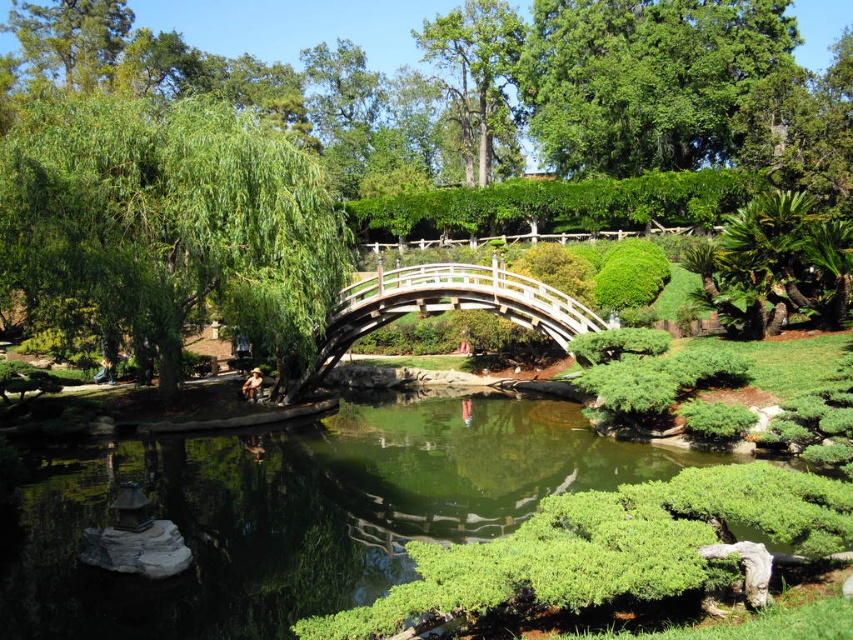
Question: Is green leafy tree at center smaller than wooden bridge at center?

Choices:
 (A) yes
 (B) no

Answer: (B)

Question: Can you confirm if green leafy tree at center is smaller than green leafy tree at left?

Choices:
 (A) yes
 (B) no

Answer: (B)

Question: Is green reflective water at center closer to camera compared to green leafy tree at upper center?

Choices:
 (A) yes
 (B) no

Answer: (A)

Question: Which point appears closest to the camera in this image?

Choices:
 (A) (595, 321)
 (B) (329, 566)
 (C) (628, 76)
 (D) (323, 272)

Answer: (B)

Question: Which object is positioned closest to the green reflective water at center?

Choices:
 (A) wooden bridge at center
 (B) green leafy tree at upper center

Answer: (A)

Question: Based on their relative distances, which object is farther from the wooden bridge at center?

Choices:
 (A) green leafy tree at center
 (B) green reflective water at center
 (C) green leafy tree at left

Answer: (A)